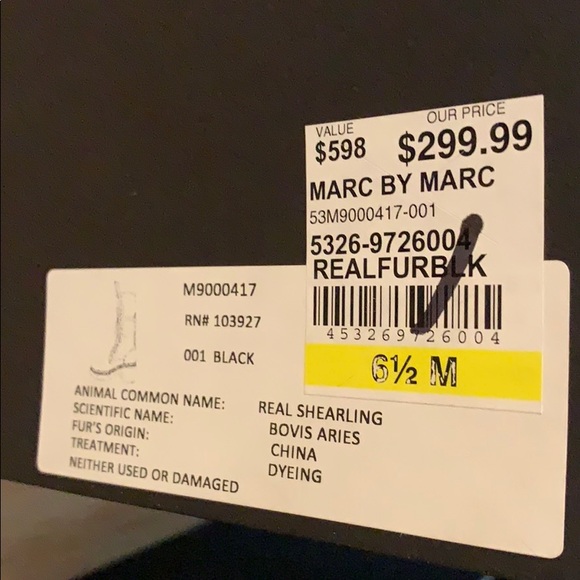
Where is `box`? The image size is (580, 580). box is located at coordinates (159, 165).